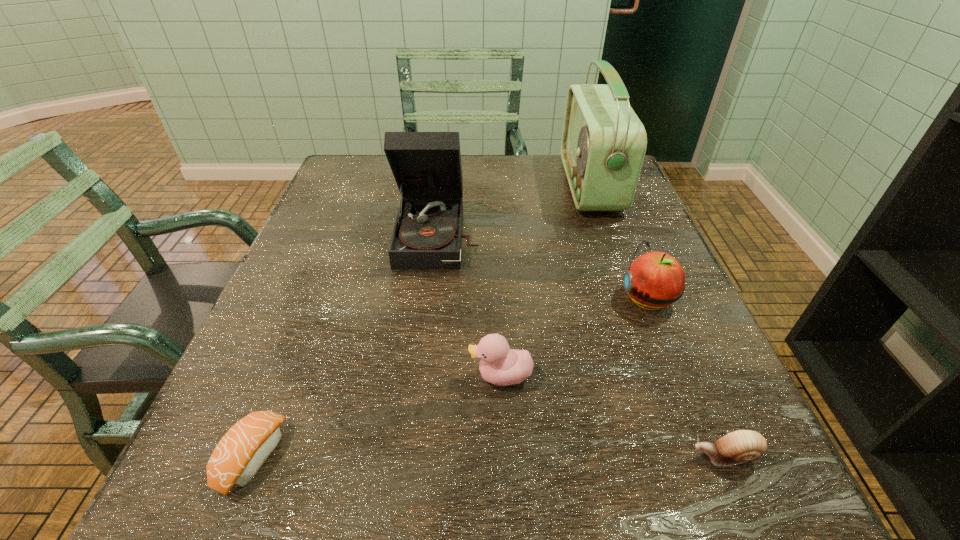
This screenshot has height=540, width=960. What are the coordinates of `vacant region located on the front panel of the radio receiver` in the screenshot? It's located at (497, 185).

The image size is (960, 540). What are the coordinates of `free point located on the front panel of the radio receiver` in the screenshot? It's located at (471, 185).

This screenshot has width=960, height=540. I want to click on free space located on the front-facing side of the fifth shortest object, so click(416, 443).

Identify the location of vacant space situated on the back of the fourth shortest object. The image size is (960, 540). (607, 197).

Where is `vacant space located on the front-facing side of the third nearest object`? vacant space located on the front-facing side of the third nearest object is located at coordinates (285, 376).

The width and height of the screenshot is (960, 540). In order to click on free space located on the front-facing side of the third nearest object in this screenshot , I will do `click(396, 376)`.

I want to click on free space located 0.130m on the front-facing side of the third nearest object, so click(390, 376).

Identify the location of free location located 0.390m on the front-facing side of the fifth tallest object. (412, 456).

Image resolution: width=960 pixels, height=540 pixels. I want to click on vacant point located on the front-facing side of the fifth tallest object, so click(475, 456).

This screenshot has height=540, width=960. I want to click on free region located 0.130m on the front-facing side of the fifth tallest object, so click(x=596, y=456).